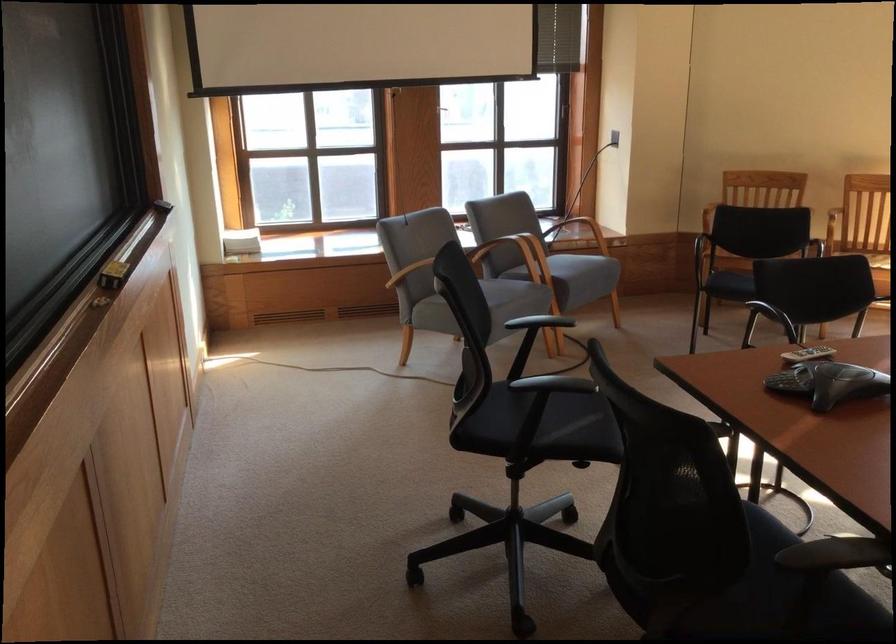
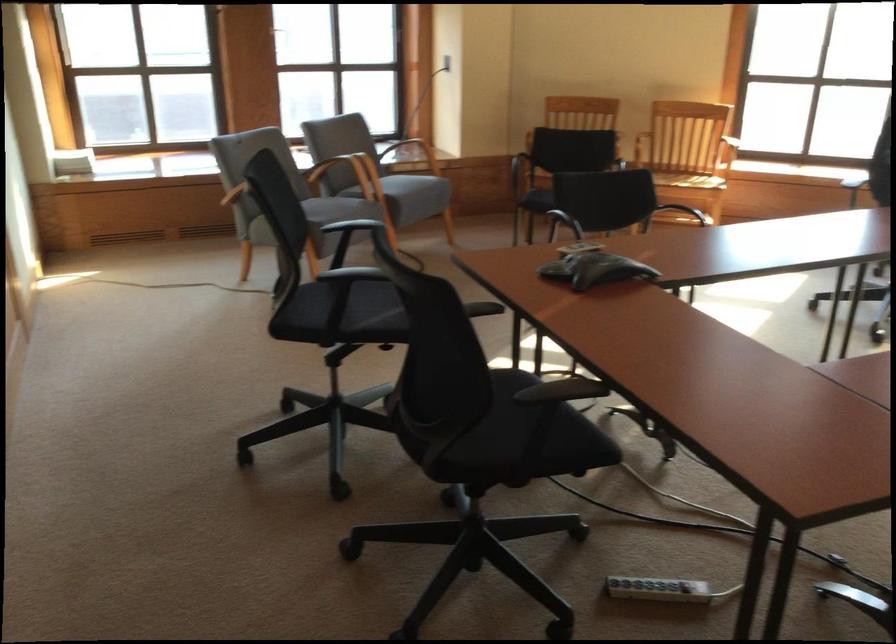
The point at (501, 249) is marked in the first image. Where is the corresponding point in the second image?

(342, 172)